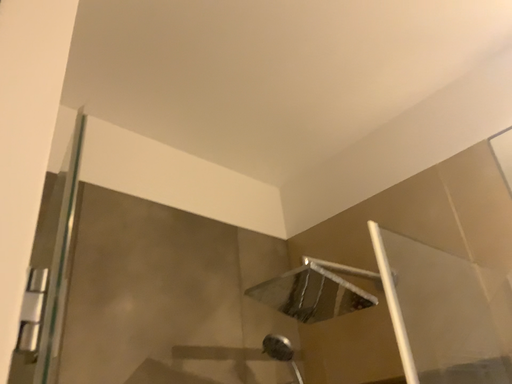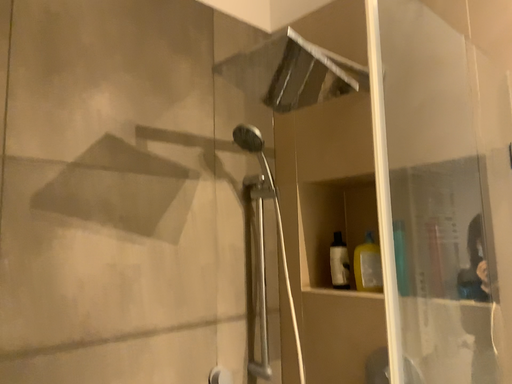
Question: How did the camera likely rotate when shooting the video?

Choices:
 (A) rotated upward
 (B) rotated downward

Answer: (B)